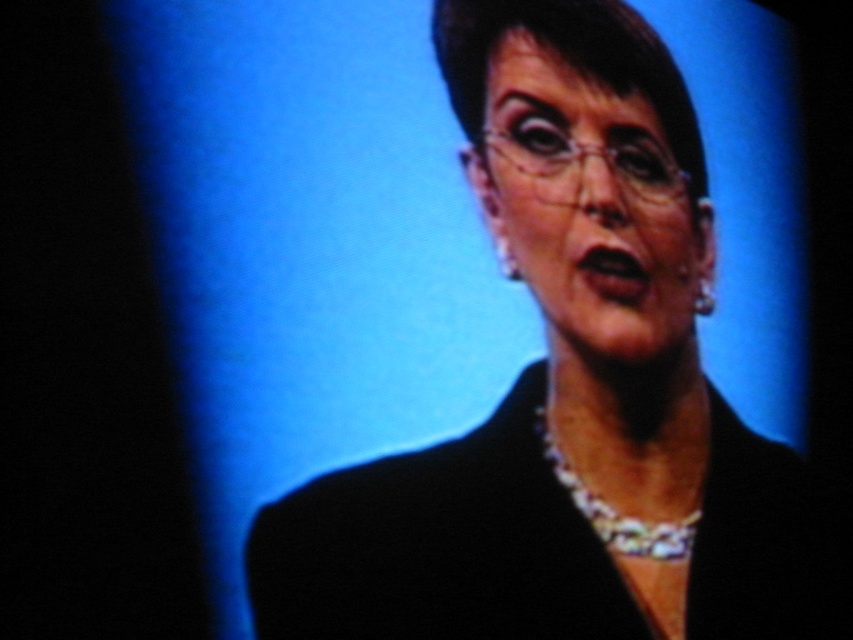
Question: Based on their relative distances, which object is nearer to the matte black face at center?

Choices:
 (A) black matte business suit at center
 (B) silver metallic necklace at center
 (C) black glossy suit at center

Answer: (C)

Question: Considering the relative positions of black glossy suit at center and black matte business suit at center in the image provided, where is black glossy suit at center located with respect to black matte business suit at center?

Choices:
 (A) left
 (B) right

Answer: (A)

Question: Can you confirm if matte black face at center is wider than silver metallic necklace at center?

Choices:
 (A) yes
 (B) no

Answer: (A)

Question: Considering the real-world distances, which object is farthest from the matte black face at center?

Choices:
 (A) black glossy suit at center
 (B) silver metallic necklace at center
 (C) black matte business suit at center

Answer: (B)

Question: Considering the real-world distances, which object is closest to the black matte business suit at center?

Choices:
 (A) matte black face at center
 (B) black glossy suit at center
 (C) silver metallic necklace at center

Answer: (B)

Question: Does black matte business suit at center appear on the left side of matte black face at center?

Choices:
 (A) yes
 (B) no

Answer: (B)